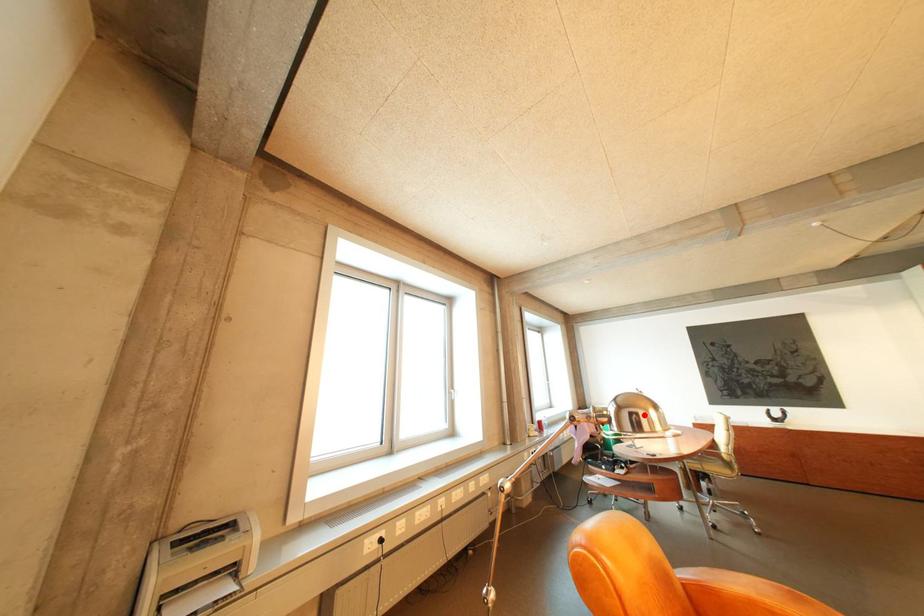
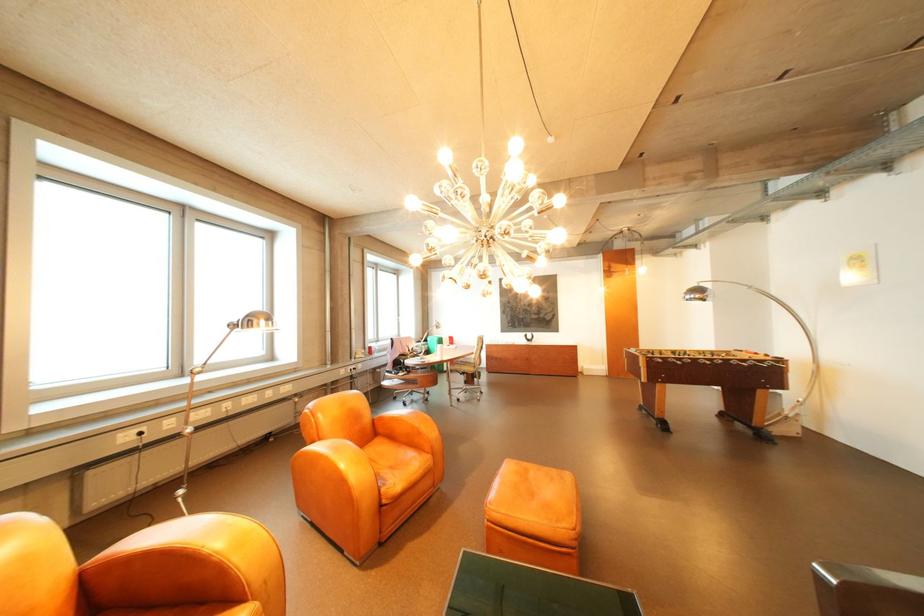
Question: I am providing you with two images of the same scene from different viewpoints. A red point is marked on the first image. Can you still see the location of the red point in image 2?

Choices:
 (A) Yes
 (B) No

Answer: (A)